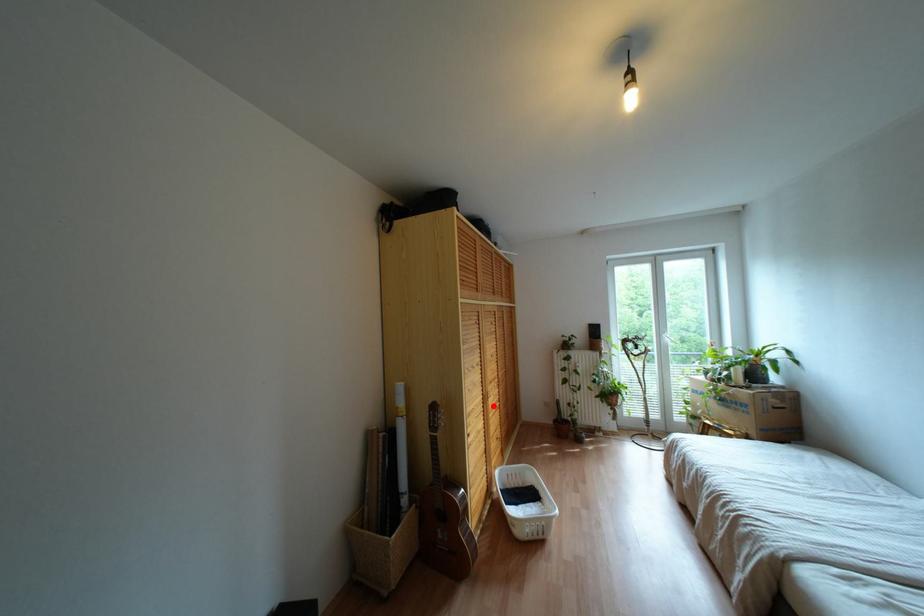
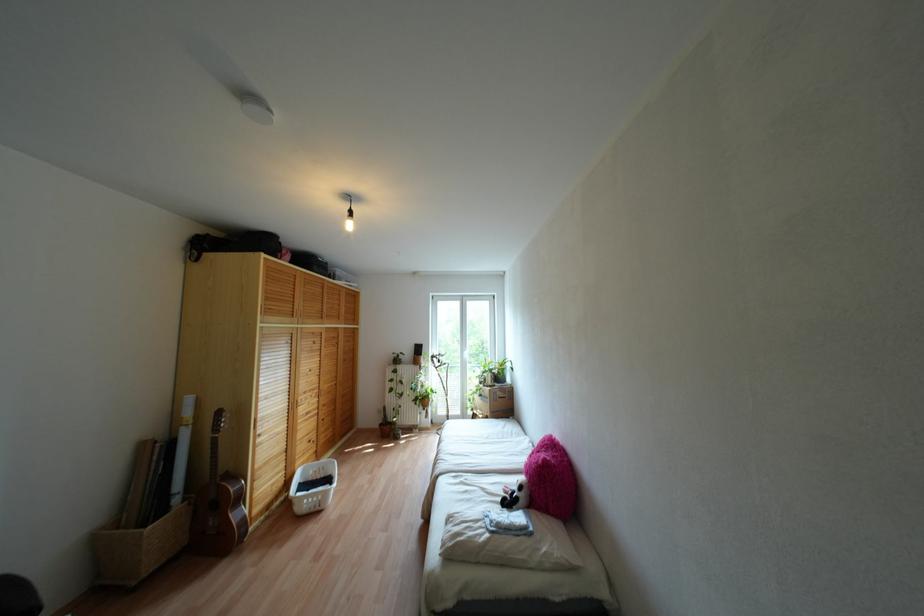
In the second image, find the point that corresponds to the highlighted location in the first image.

(307, 413)